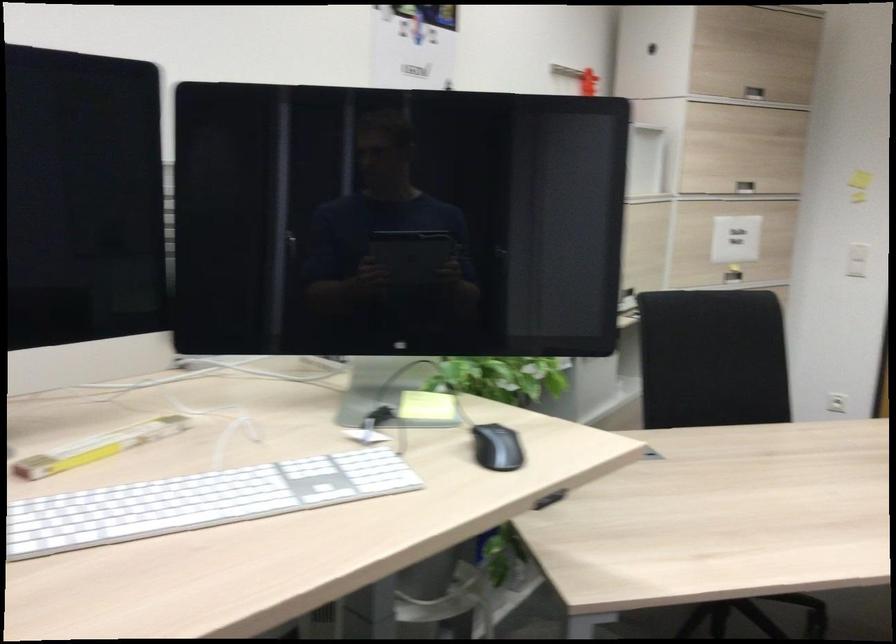
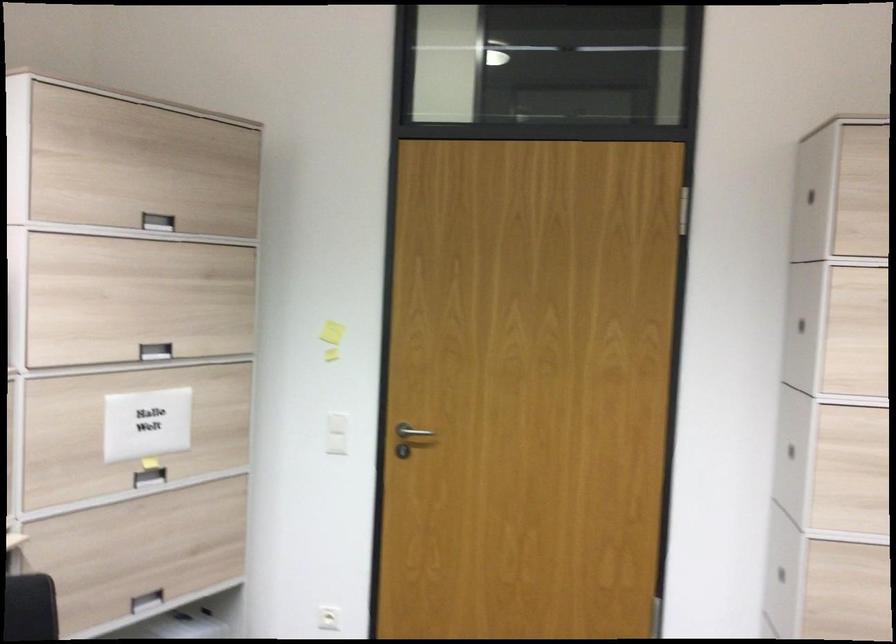
In a continuous first-person perspective shot, in which direction is the camera moving?

The cameraman moved toward right, forward.